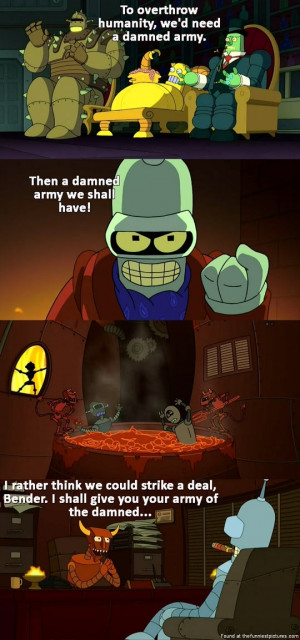
I want to click on coffee mug, so click(x=14, y=582).